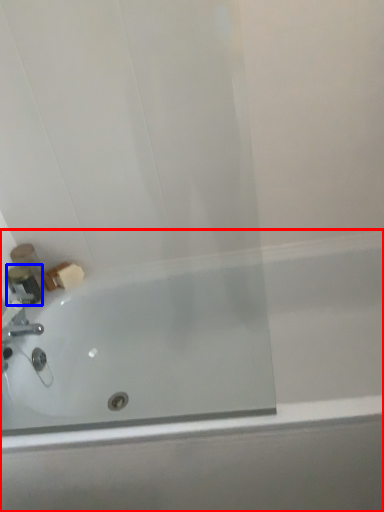
Question: Which object appears closest to the camera in this image, bathtub (highlighted by a red box) or toiletry (highlighted by a blue box)?

Choices:
 (A) bathtub
 (B) toiletry

Answer: (A)